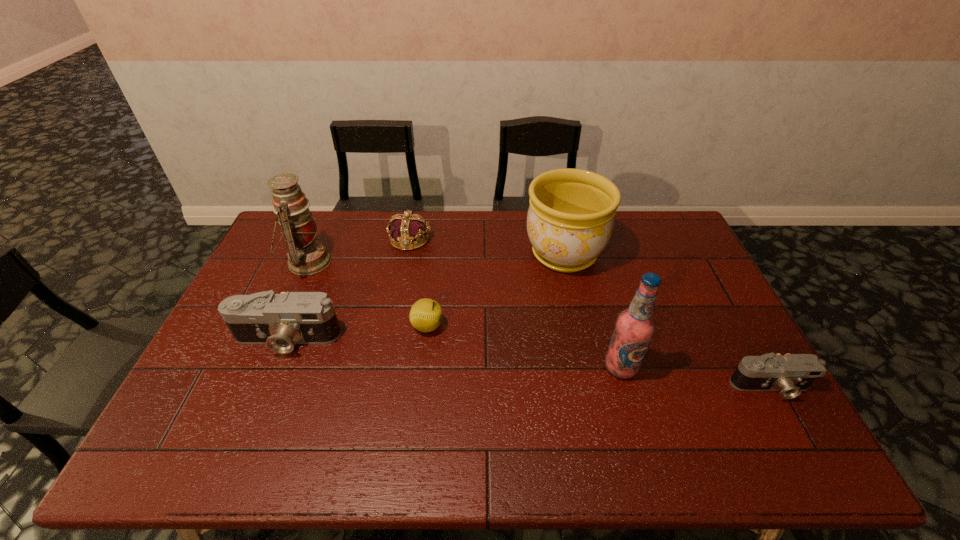
Where is `free spot located on the back of the fifth shortest object`? The height and width of the screenshot is (540, 960). free spot located on the back of the fifth shortest object is located at coordinates (556, 217).

At what (x,y) coordinates should I click in order to perform the action: click on free location located 0.220m on the front of the third shortest object. Please return your answer as a coordinate pair (x, y). Looking at the image, I should click on (398, 298).

Where is `vacant position located on the logo side of the softball`? vacant position located on the logo side of the softball is located at coordinates (502, 326).

The width and height of the screenshot is (960, 540). I want to click on free spot located on the front of the oil lamp, so click(271, 346).

You are a GUI agent. You are given a task and a screenshot of the screen. Output one action in this format:
    pyautogui.click(x=<x>, y=<y>)
    Task: Click on the vacant space located 0.210m on the left of the alcohol
    
    Given the screenshot: What is the action you would take?
    pyautogui.click(x=524, y=367)

The image size is (960, 540). In order to click on flowerpot that is at the far edge in this screenshot , I will do `click(570, 219)`.

Where is `crown at the far edge`? crown at the far edge is located at coordinates (407, 227).

Locate an element on the screen. The width and height of the screenshot is (960, 540). oil lamp located at the far edge is located at coordinates (306, 255).

Where is `object located at the near edge`? The width and height of the screenshot is (960, 540). object located at the near edge is located at coordinates (x=790, y=374).

Image resolution: width=960 pixels, height=540 pixels. Find the location of `camera positioned at the left edge`. camera positioned at the left edge is located at coordinates (282, 320).